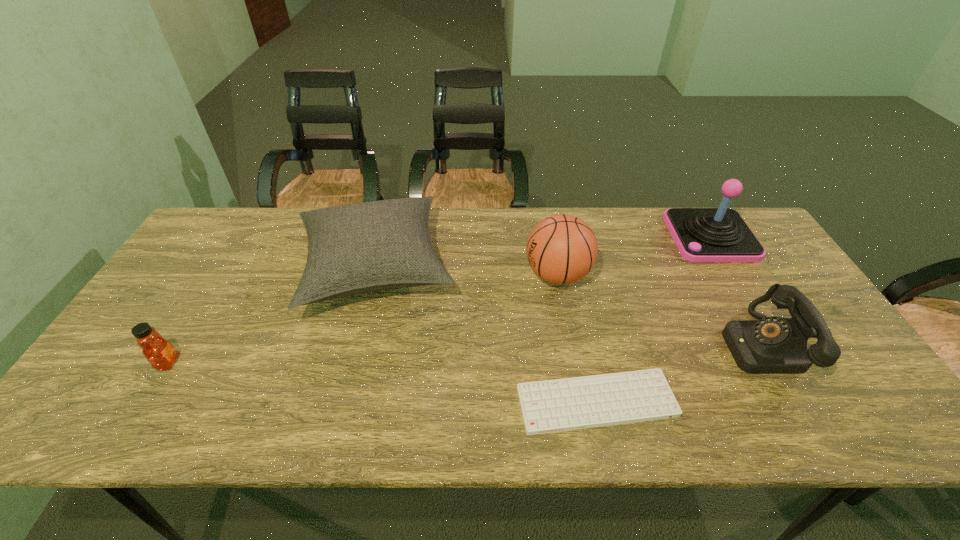
At what (x,y) coordinates should I click in order to perform the action: click on basketball located at the far edge. Please return your answer as a coordinate pair (x, y). Image resolution: width=960 pixels, height=540 pixels. Looking at the image, I should click on (561, 249).

Where is `cushion positioned at the far edge`? Image resolution: width=960 pixels, height=540 pixels. cushion positioned at the far edge is located at coordinates (358, 248).

The image size is (960, 540). What are the coordinates of `object positioned at the near edge` in the screenshot? It's located at (567, 404).

This screenshot has height=540, width=960. Find the location of `object that is at the left edge`. object that is at the left edge is located at coordinates (160, 353).

What are the coordinates of `joystick located at the right edge` in the screenshot? It's located at (720, 234).

The height and width of the screenshot is (540, 960). I want to click on telephone at the right edge, so click(x=771, y=345).

At what (x,y) coordinates should I click in order to perform the action: click on object positioned at the far right corner. Please return your answer as a coordinate pair (x, y). This screenshot has width=960, height=540. Looking at the image, I should click on (x=720, y=234).

The width and height of the screenshot is (960, 540). In the image, there is a desktop. In order to click on vacant space at the far edge in this screenshot , I will do `click(308, 207)`.

Image resolution: width=960 pixels, height=540 pixels. What are the coordinates of `free space at the near edge of the desktop` in the screenshot? It's located at (595, 430).

Identify the location of blank space at the left edge of the desktop. (173, 335).